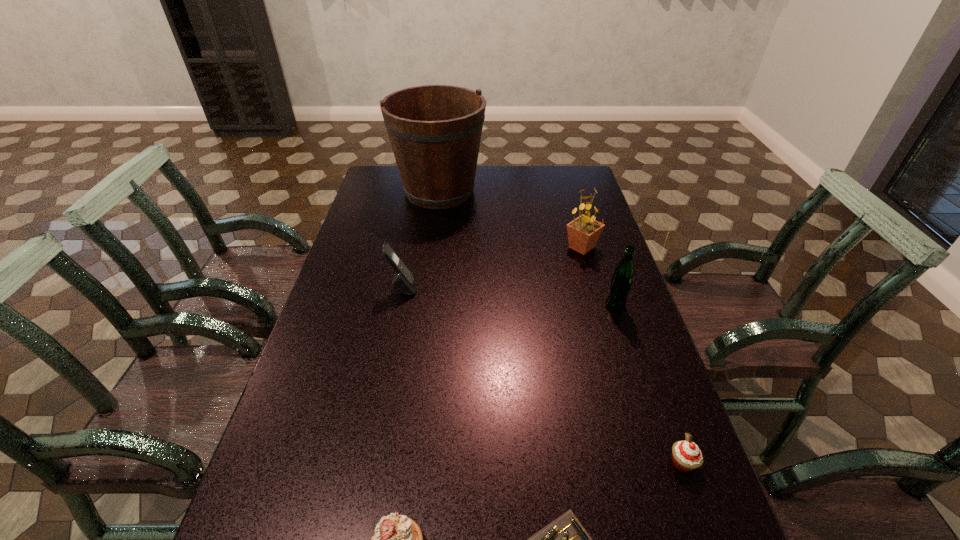
This screenshot has height=540, width=960. In order to click on the farthest object in this screenshot , I will do `click(435, 131)`.

The image size is (960, 540). In order to click on the tallest object in this screenshot , I will do `click(435, 131)`.

Where is `sunflower`? The height and width of the screenshot is (540, 960). sunflower is located at coordinates (583, 232).

What are the coordinates of `the fourth nearest object` in the screenshot? It's located at (621, 282).

Locate an element on the screen. the third farthest object is located at coordinates (405, 280).

This screenshot has height=540, width=960. In order to click on cellular telephone in this screenshot , I will do `click(405, 280)`.

Identify the location of the second shortest object. This screenshot has height=540, width=960. (687, 456).

Image resolution: width=960 pixels, height=540 pixels. What are the coordinates of `the fifth farthest object` in the screenshot? It's located at (687, 456).

Where is `vacant space located on the front of the tallest object`? The height and width of the screenshot is (540, 960). vacant space located on the front of the tallest object is located at coordinates (430, 257).

Locate an element on the screen. Image resolution: width=960 pixels, height=540 pixels. vacant space located at the front of the sunflower with flowers visible is located at coordinates (483, 247).